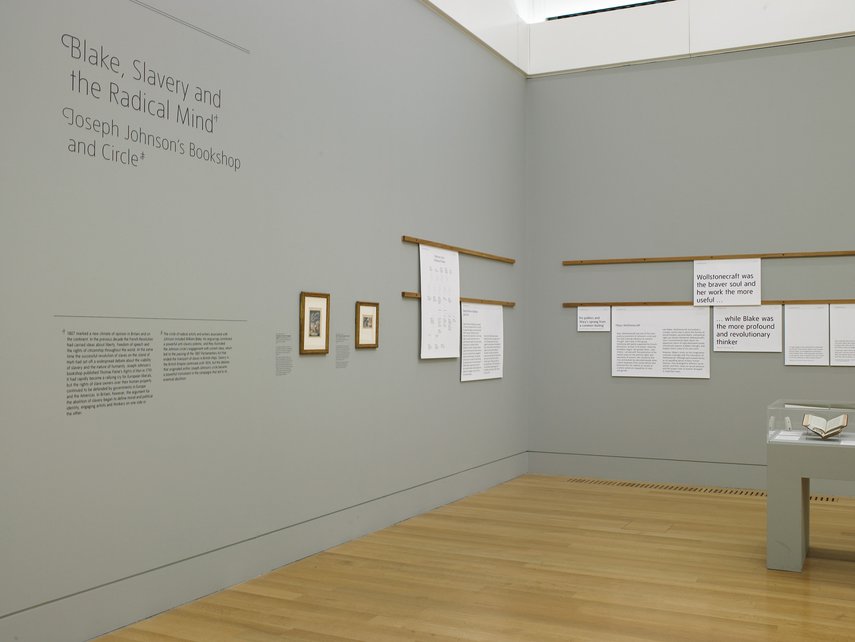
The height and width of the screenshot is (642, 855). Find the location of `1 vent area`. 1 vent area is located at coordinates tap(740, 483).